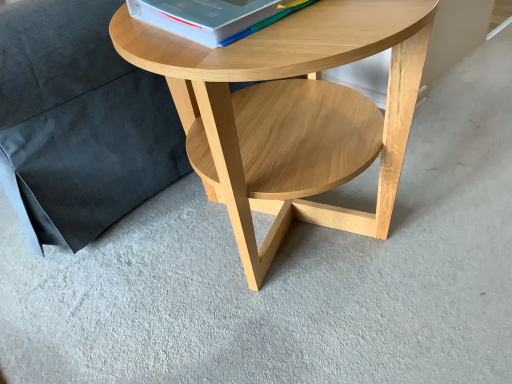
Where is `spots to the right of natural wood coffee table at center`? This screenshot has height=384, width=512. spots to the right of natural wood coffee table at center is located at coordinates (455, 206).